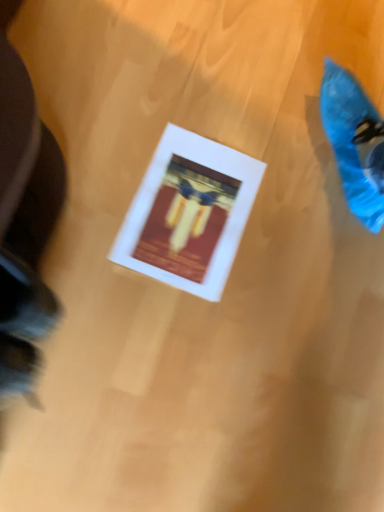
I want to click on vacant space positioned to the left of white matte picture frame at center, so click(114, 150).